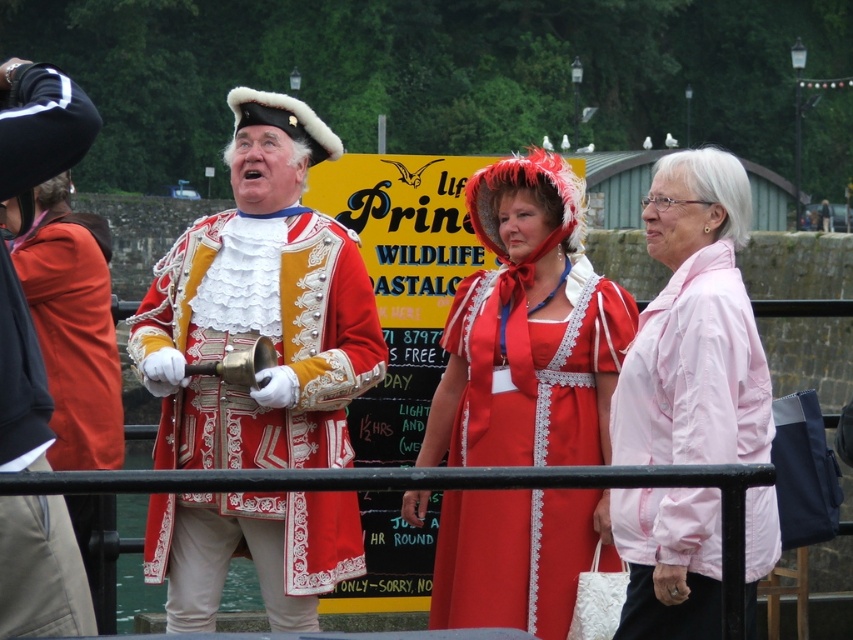
Question: Is white silky wig at upper right further to camera compared to brown fuzzy wig at upper left?

Choices:
 (A) no
 (B) yes

Answer: (A)

Question: Which of the following is the farthest from the observer?

Choices:
 (A) pink fabric jacket at right
 (B) matte gold jacket at center

Answer: (B)

Question: Estimate the real-world distances between objects in this image. Which object is closer to the matte red dress at center?

Choices:
 (A) matte gold and red coat at center
 (B) white fur wig at upper center

Answer: (A)

Question: Does white silky wig at upper right have a smaller size compared to brown fuzzy wig at upper left?

Choices:
 (A) yes
 (B) no

Answer: (B)

Question: Can you confirm if pink fabric jacket at right is bigger than matte gold jacket at center?

Choices:
 (A) yes
 (B) no

Answer: (A)

Question: Based on their relative distances, which object is nearer to the matte gold jacket at center?

Choices:
 (A) matte gold and red coat at center
 (B) white fur wig at upper center

Answer: (A)